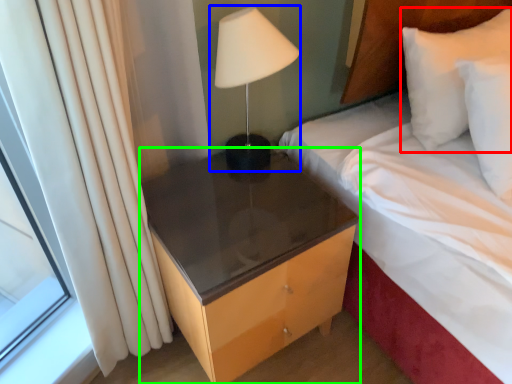
Question: Estimate the real-world distances between objects in this image. Which object is closer to pillow (highlighted by a red box), bedside lamp (highlighted by a blue box) or nightstand (highlighted by a green box)?

Choices:
 (A) bedside lamp
 (B) nightstand

Answer: (A)